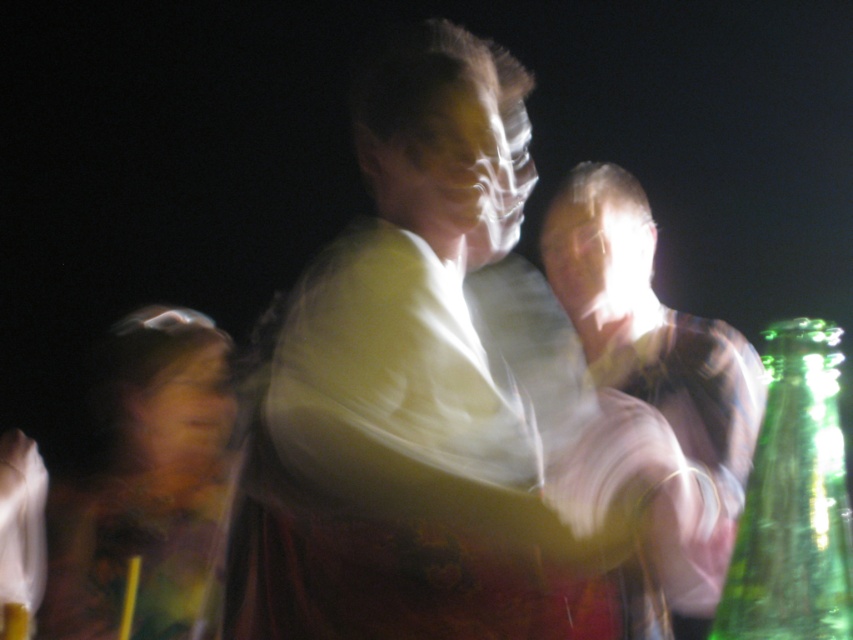
You are at a party and want to grab the green glass bottle at right without touching the white matte shirt at center. Is this possible given their positions?

The white matte shirt at center is positioned over the green glass bottle at right, so reaching for the bottle might cause contact with the shirt.

You are at a party and notice two items labeled as white matte shirt at center and matte white shirt at center. Are these two items actually the same object?

The white matte shirt at center and matte white shirt at center are likely the same object, as the description suggests they might be the same with slight variations in labeling.

You are at a party and want to grab the green glass bottle at right without touching the matte white shirt at center. Is this possible based on their positions?

The matte white shirt at center is above the green glass bottle at right, so you can reach the green glass bottle at right without touching the matte white shirt at center as long as you avoid the area directly under the shirt.